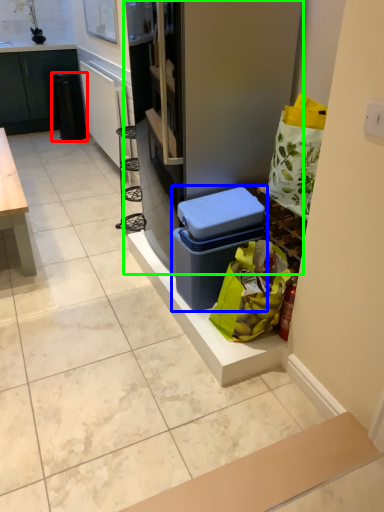
Question: Which object is positioned closest to trash bin/can (highlighted by a red box)? Select from storage box (highlighted by a blue box) and fridge (highlighted by a green box).

Choices:
 (A) storage box
 (B) fridge

Answer: (B)